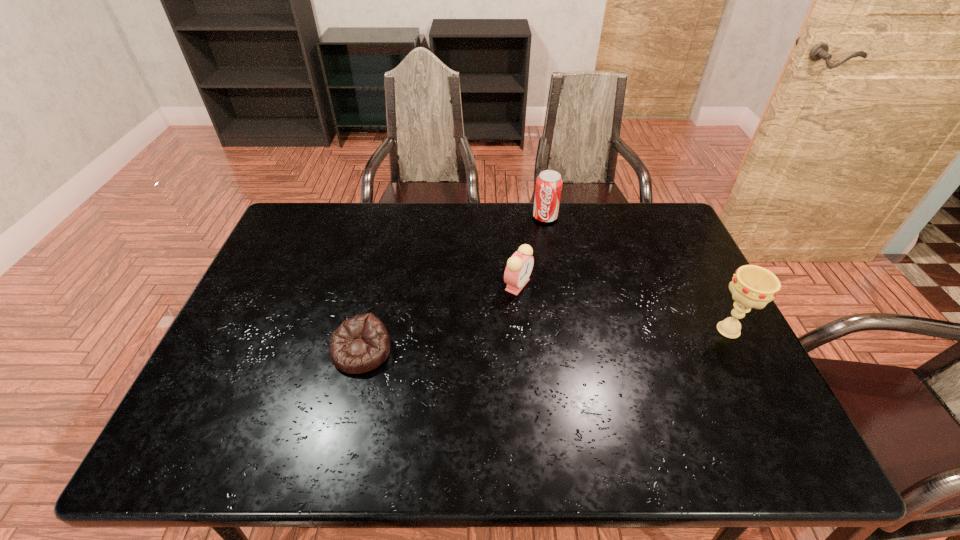
This screenshot has width=960, height=540. What are the coordinates of `blank region between the alarm clock and the rightmost object` in the screenshot? It's located at (623, 307).

Find the location of `object that is the nearest to the chalice`. object that is the nearest to the chalice is located at coordinates (519, 266).

The width and height of the screenshot is (960, 540). Identify the location of the second closest object to the leftmost object. (549, 183).

The height and width of the screenshot is (540, 960). Find the location of `free space that satisfies the following two spatial constraints: 1. on the back side of the second shortest object; 2. on the right side of the beanbag`. free space that satisfies the following two spatial constraints: 1. on the back side of the second shortest object; 2. on the right side of the beanbag is located at coordinates (377, 285).

The height and width of the screenshot is (540, 960). Find the location of `free space that satisfies the following two spatial constraints: 1. on the back side of the third nearest object; 2. on the left side of the beanbag`. free space that satisfies the following two spatial constraints: 1. on the back side of the third nearest object; 2. on the left side of the beanbag is located at coordinates (377, 285).

This screenshot has width=960, height=540. Find the location of `blank space that satisfies the following two spatial constraints: 1. on the front side of the second farthest object; 2. on the left side of the rightmost object`. blank space that satisfies the following two spatial constraints: 1. on the front side of the second farthest object; 2. on the left side of the rightmost object is located at coordinates (522, 330).

This screenshot has width=960, height=540. I want to click on free spot that satisfies the following two spatial constraints: 1. on the back side of the second object from right to left; 2. on the left side of the alarm clock, so click(x=512, y=217).